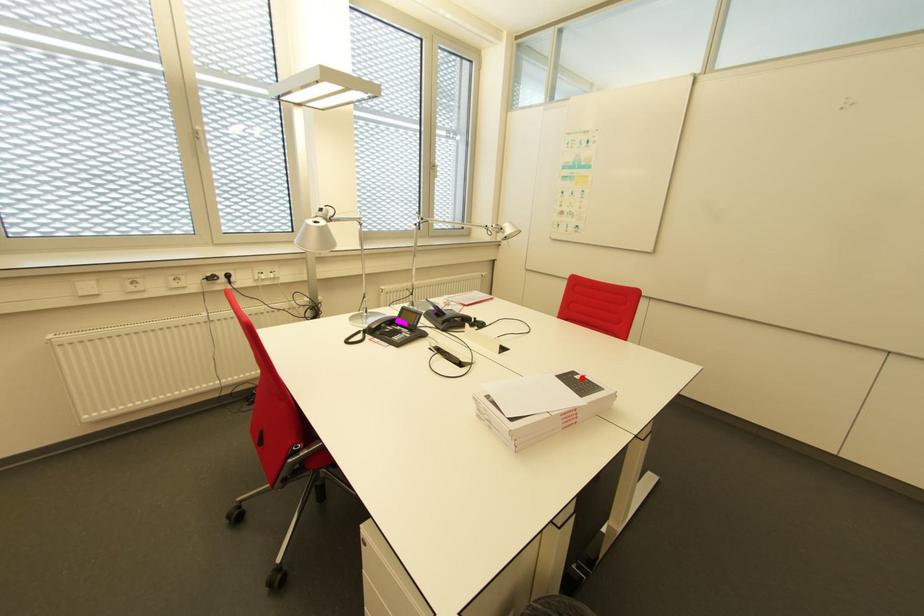
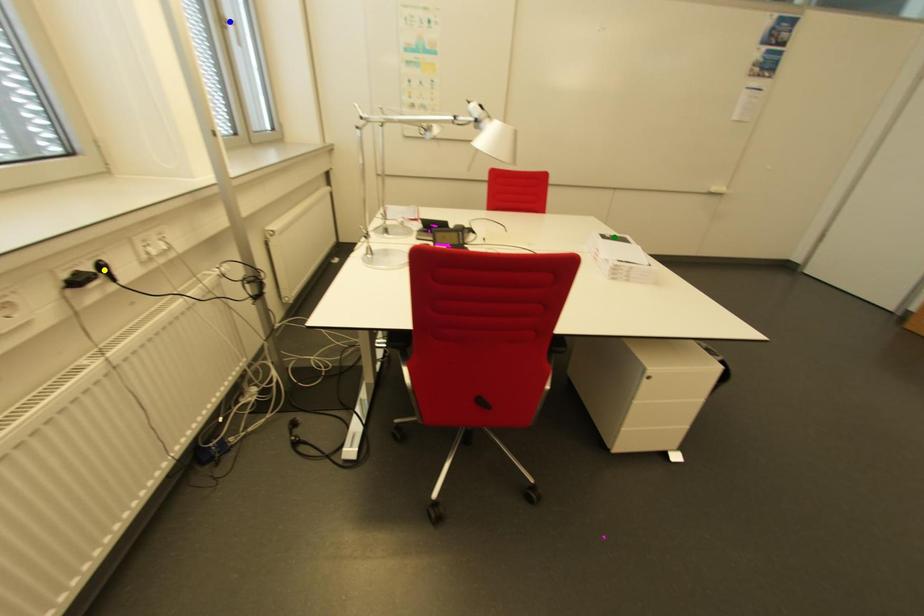
Question: I am providing you with two images of the same scene from different viewpoints. A red point is marked on the first image. You are given multiple points on the second image. In image 2, which mark is for the same physical point as the one in image 1?

Choices:
 (A) yellow point
 (B) blue point
 (C) green point

Answer: (C)